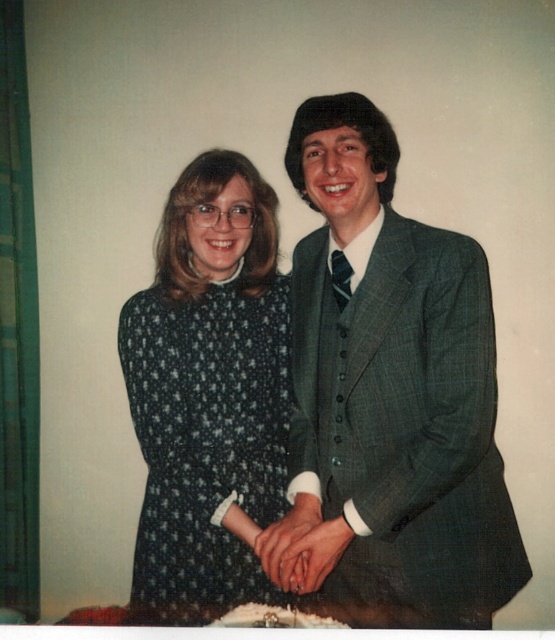
Looking at this image, between green textured suit at center and dark blue dotted fabric dress at center, which one has more height?

green textured suit at center

Does green textured suit at center have a smaller size compared to dark blue dotted fabric dress at center?

No.

Is point (455, 305) more distant than point (281, 456)?

No, (455, 305) is in front of (281, 456).

The width and height of the screenshot is (555, 640). Find the location of `green textured suit at center`. green textured suit at center is located at coordinates (395, 380).

This screenshot has height=640, width=555. What do you see at coordinates (395, 380) in the screenshot?
I see `green textured suit at center` at bounding box center [395, 380].

Is point (387, 163) positioned after point (284, 586)?

Yes.

What do you see at coordinates (395, 380) in the screenshot? I see `green textured suit at center` at bounding box center [395, 380].

Find the location of a particular element. green textured suit at center is located at coordinates (395, 380).

From the picture: Which is above, dark blue dotted fabric dress at center or smooth skin hands at center?

dark blue dotted fabric dress at center is above.

In the scene shown: Which is more to the left, dark blue dotted fabric dress at center or smooth skin hands at center?

dark blue dotted fabric dress at center

Which is behind, point (214, 557) or point (285, 540)?

The point (214, 557) is more distant.

Where is `dark blue dotted fabric dress at center`? This screenshot has width=555, height=640. dark blue dotted fabric dress at center is located at coordinates (206, 435).